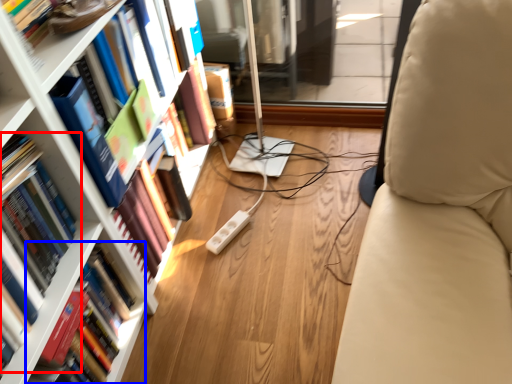
Question: Which object appears farthest to the camera in this image, book (highlighted by a red box) or book (highlighted by a blue box)?

Choices:
 (A) book
 (B) book

Answer: (B)